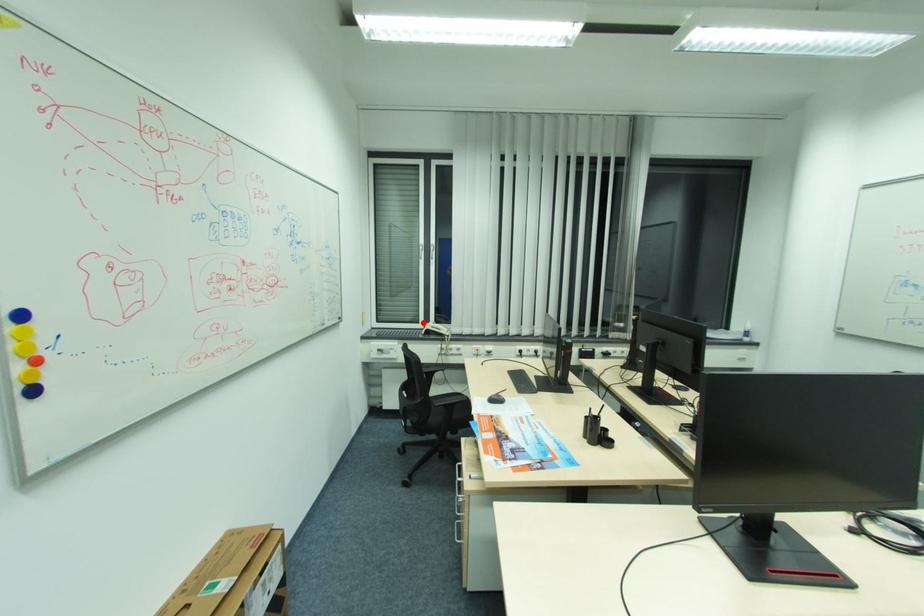
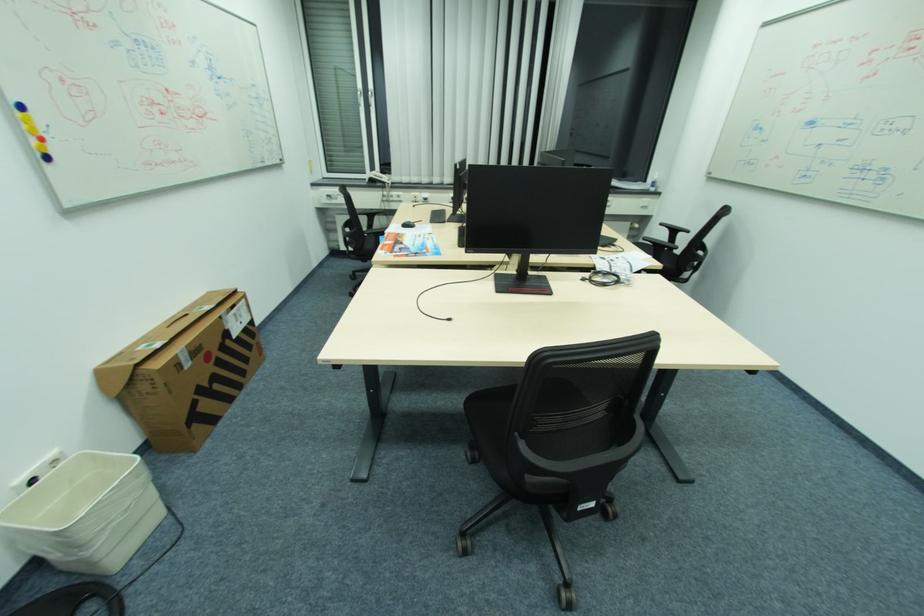
In the second image, find the point that corresponds to the highlighted location in the first image.

(370, 174)